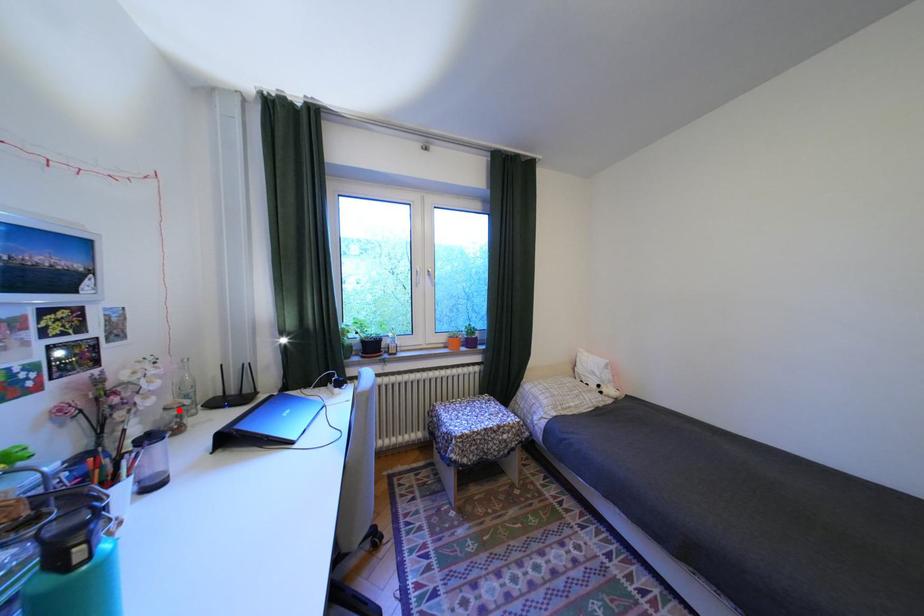
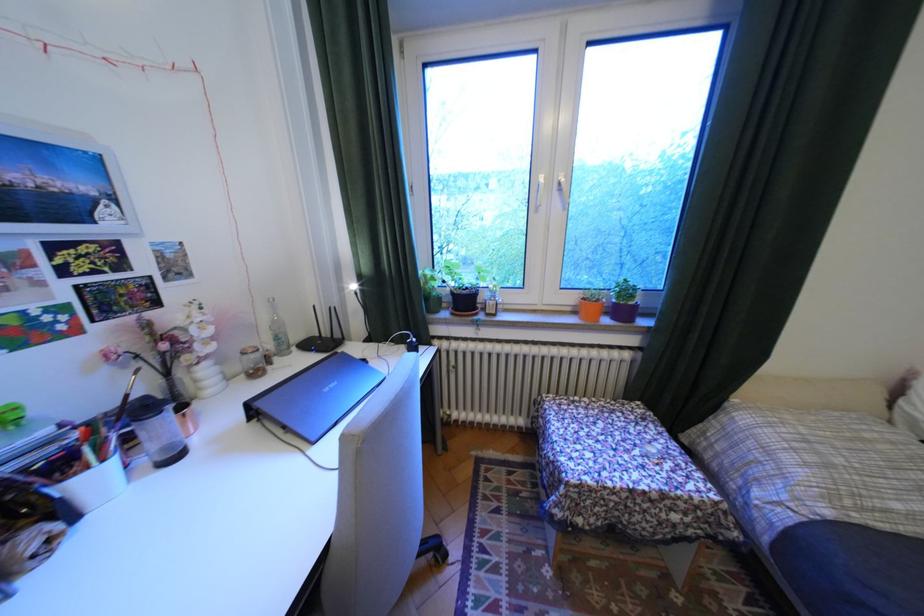
Find the pixel in the second image that matches the highlighted location in the first image.

(254, 354)